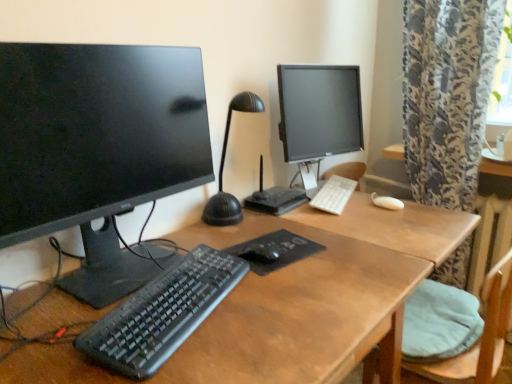
At what (x,y) coordinates should I click in order to perform the action: click on vacant area on top of black textured mousepad at center (from a real-world perspective). Please return your answer as a coordinate pair (x, y). This screenshot has width=512, height=384. Looking at the image, I should click on (268, 243).